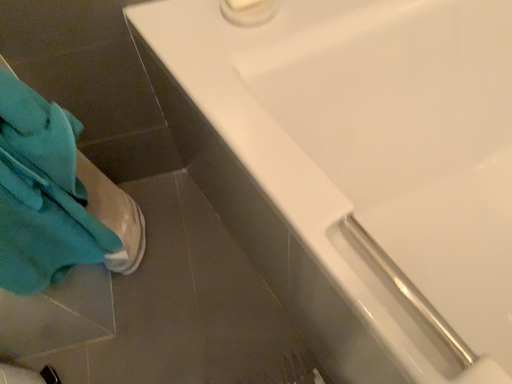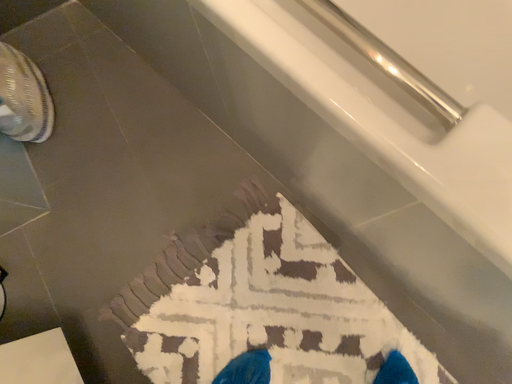
Question: Which way did the camera rotate in the video?

Choices:
 (A) rotated left
 (B) rotated right

Answer: (B)